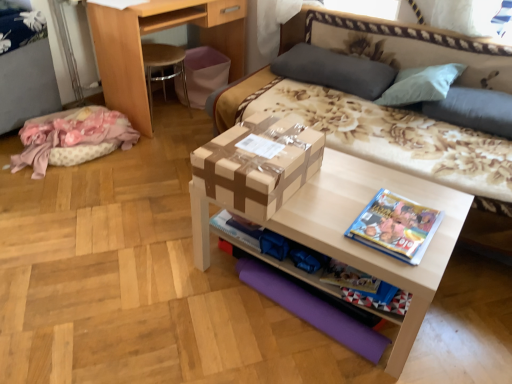
What are the coordinates of `free area behind blue glossy book at right` in the screenshot? It's located at (374, 187).